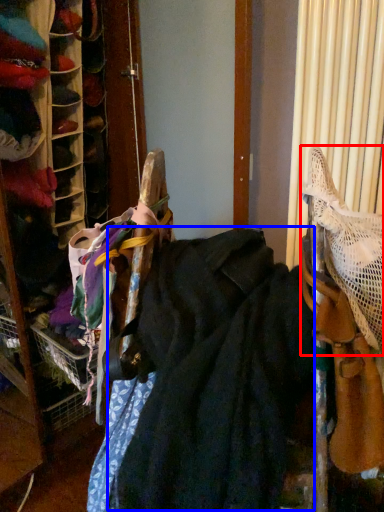
Question: Which object is further to the camera taking this photo, wide (highlighted by a red box) or wide (highlighted by a blue box)?

Choices:
 (A) wide
 (B) wide

Answer: (A)